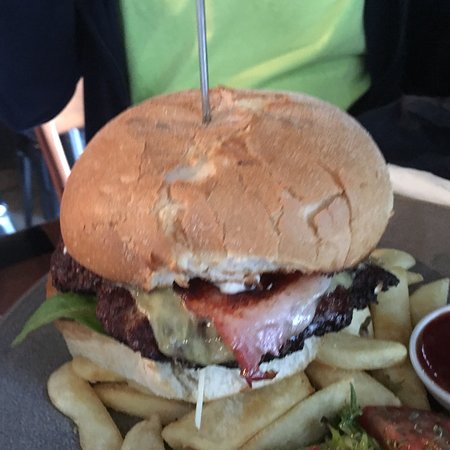
Where is `white bowl`? white bowl is located at coordinates (448, 308), (428, 317), (413, 342), (420, 371), (438, 391), (449, 399).